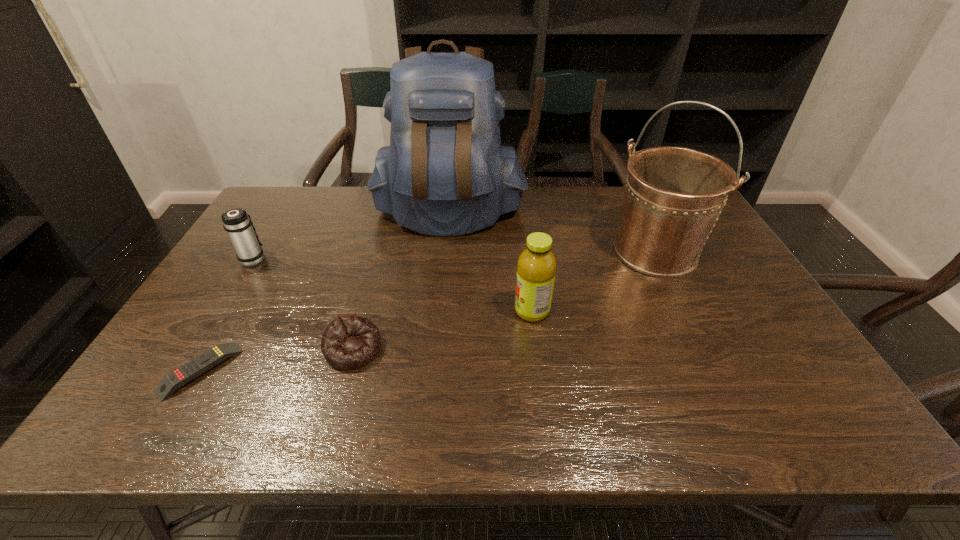
This screenshot has height=540, width=960. Find the location of `backpack`. backpack is located at coordinates (445, 173).

You are a GUI agent. You are given a task and a screenshot of the screen. Output one action in this format:
    pyautogui.click(x=<x>, y=<y>)
    Task: Click on the rightmost object
    The image size is (960, 540).
    Given the screenshot: What is the action you would take?
    pyautogui.click(x=674, y=195)

Locate an element on the screen. the third nearest object is located at coordinates (536, 267).

Locate an element on the screen. Image resolution: width=960 pixels, height=540 pixels. the fourth shortest object is located at coordinates (536, 267).

Find the location of a particular element. the fourth tallest object is located at coordinates (237, 223).

At what (x,y) coordinates should I click in order to perform the action: click on beanbag. Please return your answer as a coordinate pair (x, y). The image size is (960, 540). Looking at the image, I should click on (349, 342).

I want to click on the shortest object, so click(182, 375).

At what (x,y) coordinates should I click in order to perform the action: click on free point located 0.270m at the front pocket of the backpack. Please return your answer as a coordinate pair (x, y). Looking at the image, I should click on (440, 301).

In order to click on free space located 0.100m on the left of the bucket in this screenshot , I will do `click(576, 252)`.

At what (x,y) coordinates should I click in order to perform the action: click on free space located on the front label of the fruit juice. Please return your answer as a coordinate pair (x, y). This screenshot has width=960, height=540. Looking at the image, I should click on (373, 311).